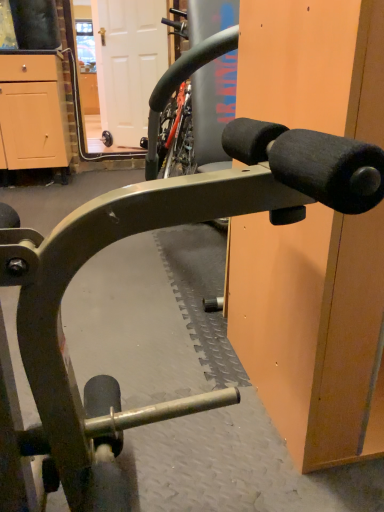
Question: Considering their positions, is light wood cabinet at left located in front of or behind white matte door at upper center?

Choices:
 (A) front
 (B) behind

Answer: (A)

Question: Looking at their shapes, would you say light wood cabinet at left is wider or thinner than white matte door at upper center?

Choices:
 (A) thin
 (B) wide

Answer: (B)

Question: In terms of height, does light wood cabinet at left look taller or shorter compared to white matte door at upper center?

Choices:
 (A) short
 (B) tall

Answer: (A)

Question: In terms of height, does white matte door at upper center look taller or shorter compared to light wood cabinet at left?

Choices:
 (A) tall
 (B) short

Answer: (A)

Question: From the image's perspective, is white matte door at upper center located above or below light wood cabinet at left?

Choices:
 (A) below
 (B) above

Answer: (B)

Question: Is point (102, 53) positioned closer to the camera than point (36, 68)?

Choices:
 (A) farther
 (B) closer

Answer: (A)

Question: Looking at their shapes, would you say white matte door at upper center is wider or thinner than light wood cabinet at left?

Choices:
 (A) thin
 (B) wide

Answer: (A)